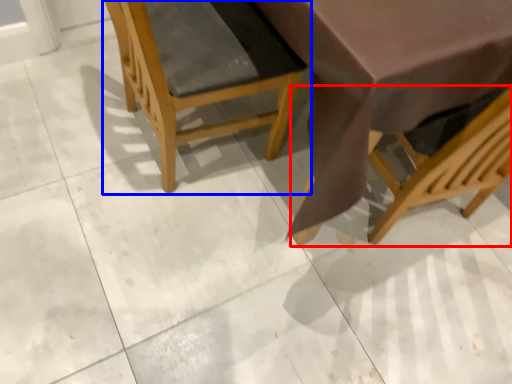
Question: Which object appears closest to the camera in this image, chair (highlighted by a red box) or chair (highlighted by a blue box)?

Choices:
 (A) chair
 (B) chair

Answer: (A)